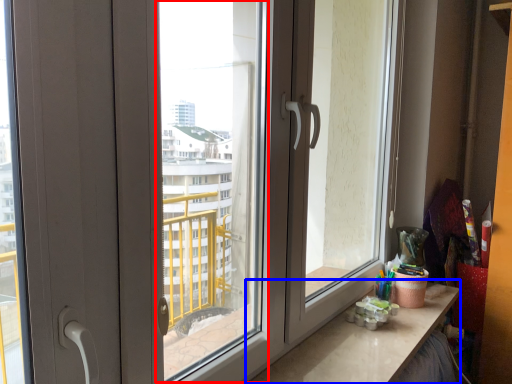
Question: Which point is closer to the camera, window screen (highlighted by a red box) or counter top (highlighted by a blue box)?

Choices:
 (A) window screen
 (B) counter top

Answer: (A)